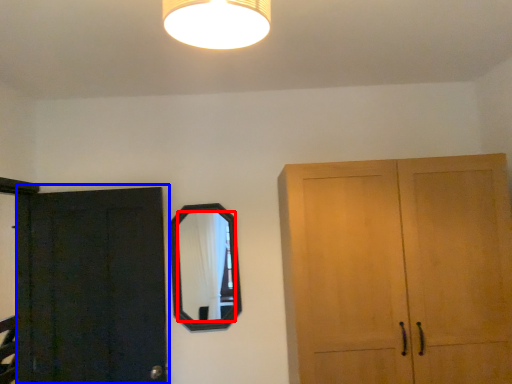
Question: Among these objects, which one is nearest to the camera, mirror (highlighted by a red box) or door (highlighted by a blue box)?

Choices:
 (A) mirror
 (B) door

Answer: (B)